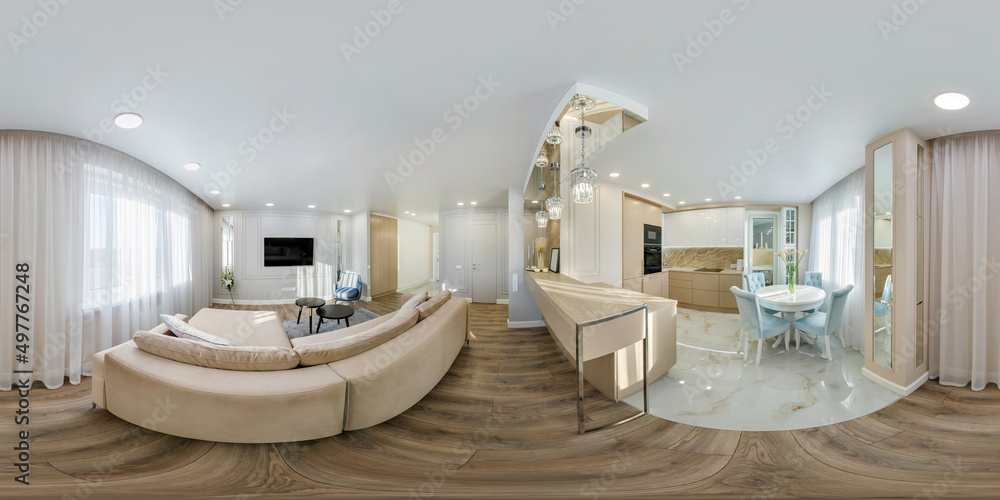
Identify the location of mirror. (598, 127), (884, 219), (760, 255).